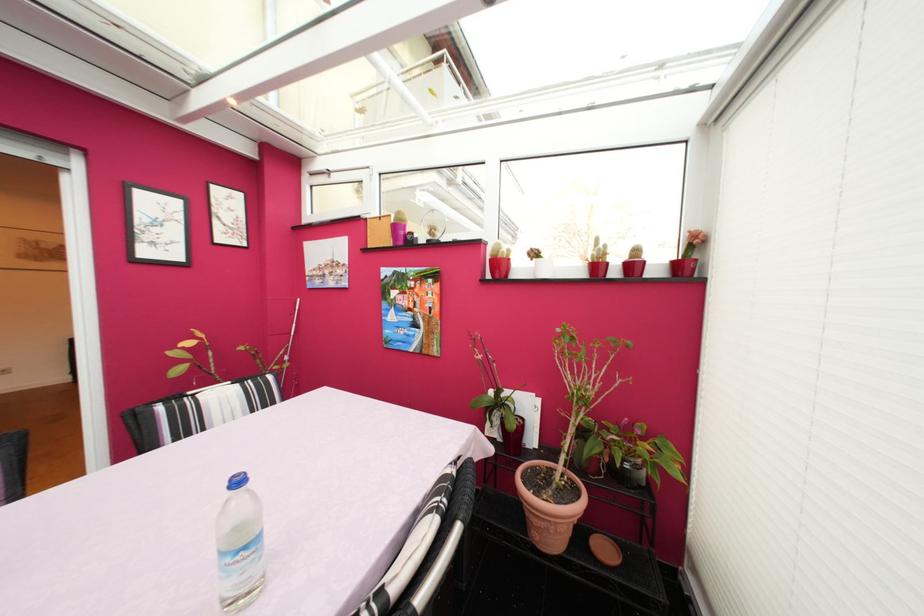
At what (x,y) coordinates should I click in order to perform the action: click on striped chair sitting surface. Please return your answer as a coordinate pair (x, y). Looking at the image, I should click on (198, 410).